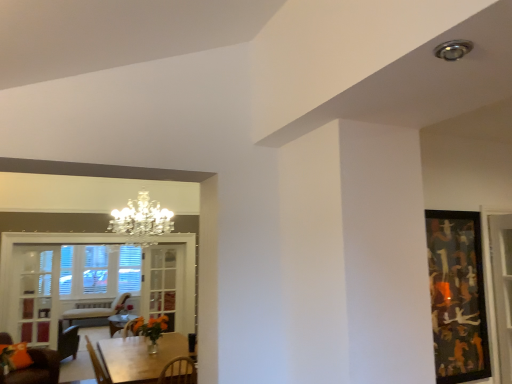
Question: Based on their sizes in the image, would you say clear glass door at center, the first glass door in the right-to-left sequence, is bigger or smaller than wooden table at lower left?

Choices:
 (A) big
 (B) small

Answer: (B)

Question: From the image's perspective, relative to wooden table at lower left, is clear glass door at center, placed as the second glass door when sorted from front to back, above or below?

Choices:
 (A) above
 (B) below

Answer: (A)

Question: Estimate the real-world distances between objects in this image. Which object is farther from the abstract painting at right?

Choices:
 (A) orange matte vase at center
 (B) clear glass door at center, placed as the second glass door when sorted from front to back
 (C) velvet orange cushion at lower left
 (D) wooden table at lower left
 (E) clear glass cabinet at left, acting as the 1th glass door starting from the front

Answer: (E)

Question: Which is nearer to the clear glass door at center, which is the first glass door from back to front?

Choices:
 (A) abstract painting at right
 (B) clear glass window at lower left
 (C) orange matte vase at center
 (D) velvet orange cushion at lower left
 (E) wooden table at lower left

Answer: (B)